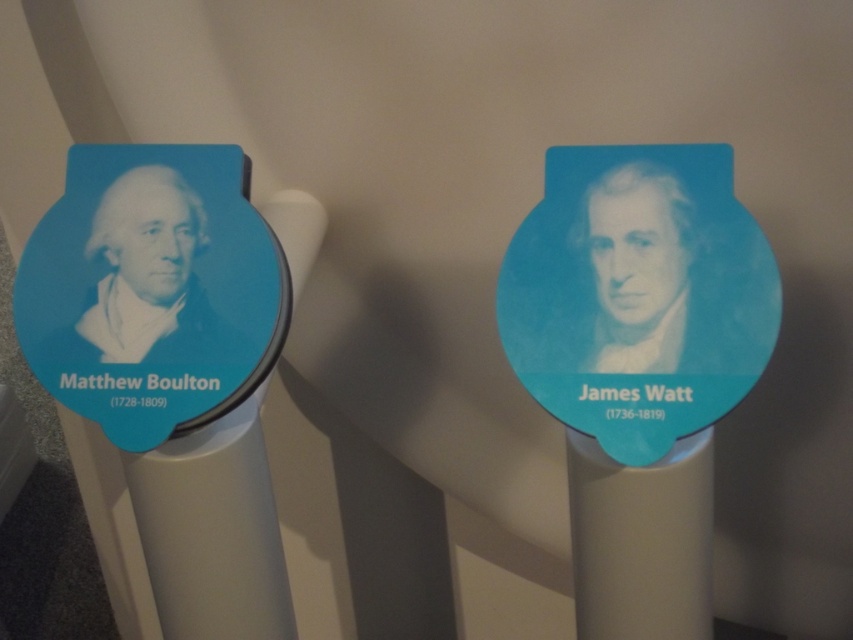
Does matte plastic pillar at center come behind blue matte portrait at left?

No, matte plastic pillar at center is in front of blue matte portrait at left.

Can you confirm if matte plastic pillar at center is shorter than blue matte portrait at left?

Incorrect, matte plastic pillar at center's height does not fall short of blue matte portrait at left's.

Does point (659, 634) lie in front of point (170, 317)?

No.

The image size is (853, 640). I want to click on matte plastic pillar at center, so click(x=641, y=540).

Which is more to the right, blue glossy portrait at center or blue matte portrait at left?

Positioned to the right is blue glossy portrait at center.

Is point (674, 269) farther from viewer compared to point (146, 280)?

No, (674, 269) is in front of (146, 280).

This screenshot has width=853, height=640. I want to click on blue glossy portrait at center, so click(x=640, y=273).

Find the location of a particular element. The width and height of the screenshot is (853, 640). blue matte sticker at left is located at coordinates (152, 289).

Can you confirm if blue matte sticker at left is taller than blue matte portrait at left?

Yes, blue matte sticker at left is taller than blue matte portrait at left.

Does point (62, 401) come in front of point (175, 256)?

Yes, point (62, 401) is closer to viewer.

You are a GUI agent. You are given a task and a screenshot of the screen. Output one action in this format:
    pyautogui.click(x=<x>, y=<y>)
    Task: Click on the blue matte sticker at left
    
    Given the screenshot: What is the action you would take?
    pyautogui.click(x=152, y=289)